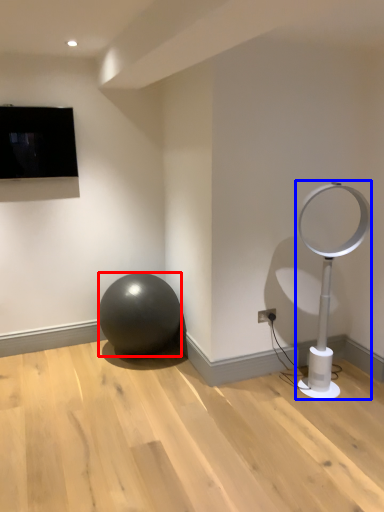
Question: Which object is closer to the camera taking this photo, ball (highlighted by a red box) or lamp (highlighted by a blue box)?

Choices:
 (A) ball
 (B) lamp

Answer: (B)